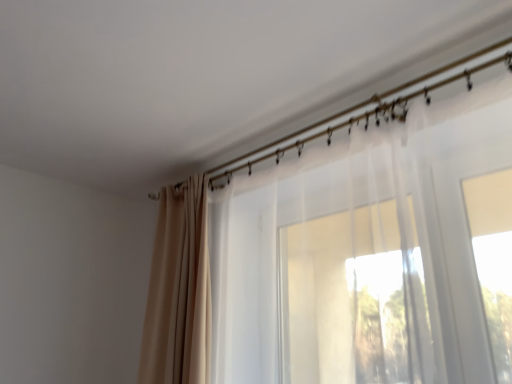
Question: Should I look upward or downward to see metallic gold curtain rod at upper center?

Choices:
 (A) up
 (B) down

Answer: (A)

Question: Is there a large distance between beige fabric curtain at upper left, the 2th curtain in the right-to-left sequence, and metallic gold curtain rod at upper center?

Choices:
 (A) yes
 (B) no

Answer: (B)

Question: Is beige fabric curtain at upper left, which is counted as the 1th curtain, starting from the left, positioned with its back to metallic gold curtain rod at upper center?

Choices:
 (A) yes
 (B) no

Answer: (B)

Question: Can you confirm if beige fabric curtain at upper left, the 2th curtain in the right-to-left sequence, is smaller than metallic gold curtain rod at upper center?

Choices:
 (A) no
 (B) yes

Answer: (A)

Question: From a real-world perspective, is beige fabric curtain at upper left, the 2th curtain in the right-to-left sequence, beneath metallic gold curtain rod at upper center?

Choices:
 (A) no
 (B) yes

Answer: (B)

Question: From a real-world perspective, is beige fabric curtain at upper left, which is counted as the 1th curtain, starting from the left, over metallic gold curtain rod at upper center?

Choices:
 (A) no
 (B) yes

Answer: (A)

Question: Considering the relative positions of beige fabric curtain at upper left, which is counted as the 1th curtain, starting from the left, and metallic gold curtain rod at upper center in the image provided, is beige fabric curtain at upper left, which is counted as the 1th curtain, starting from the left, behind metallic gold curtain rod at upper center?

Choices:
 (A) no
 (B) yes

Answer: (B)

Question: Could you tell me if metallic gold curtain rod at upper center is turned towards translucent white curtain at center, the first curtain from the right?

Choices:
 (A) no
 (B) yes

Answer: (A)

Question: Is metallic gold curtain rod at upper center positioned with its back to translucent white curtain at center, the first curtain from the right?

Choices:
 (A) yes
 (B) no

Answer: (B)

Question: Is translucent white curtain at center, the first curtain from the right, surrounded by metallic gold curtain rod at upper center?

Choices:
 (A) yes
 (B) no

Answer: (B)

Question: Does metallic gold curtain rod at upper center have a larger size compared to translucent white curtain at center, the first curtain from the right?

Choices:
 (A) no
 (B) yes

Answer: (A)

Question: From a real-world perspective, is metallic gold curtain rod at upper center on translucent white curtain at center, acting as the second curtain starting from the left?

Choices:
 (A) yes
 (B) no

Answer: (A)

Question: Is metallic gold curtain rod at upper center wider than translucent white curtain at center, the first curtain from the right?

Choices:
 (A) no
 (B) yes

Answer: (A)

Question: Is metallic gold curtain rod at upper center at the back of translucent white curtain at center, the first curtain from the right?

Choices:
 (A) no
 (B) yes

Answer: (A)